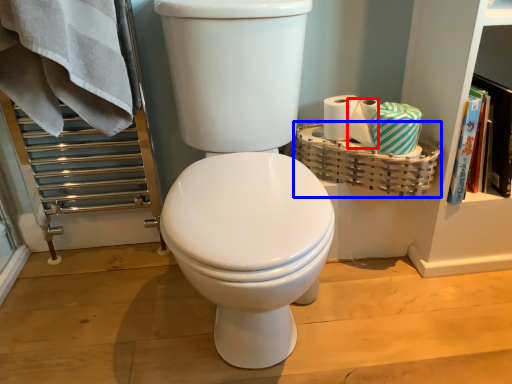
Question: Which object appears closest to the camera in this image, toilet paper (highlighted by a red box) or basket (highlighted by a blue box)?

Choices:
 (A) toilet paper
 (B) basket

Answer: (B)